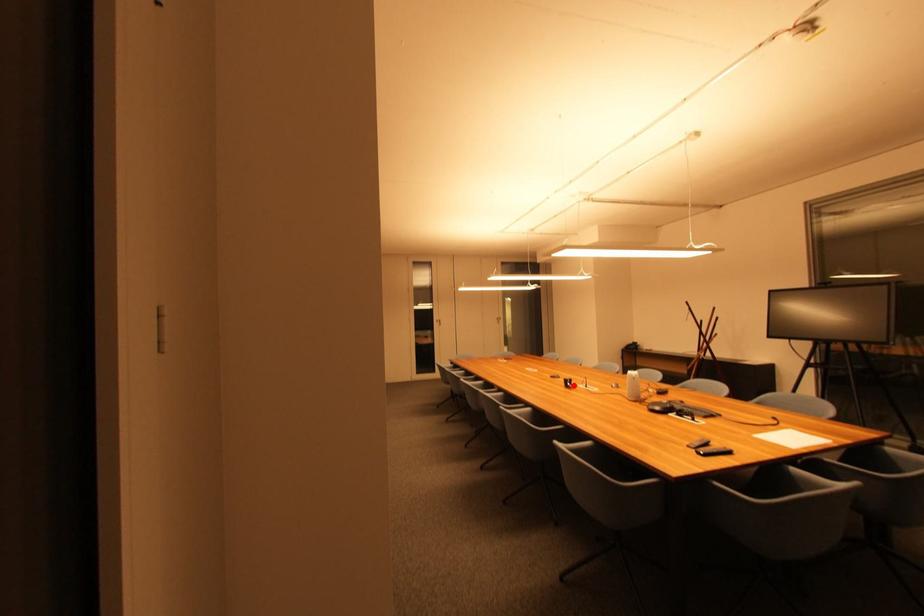
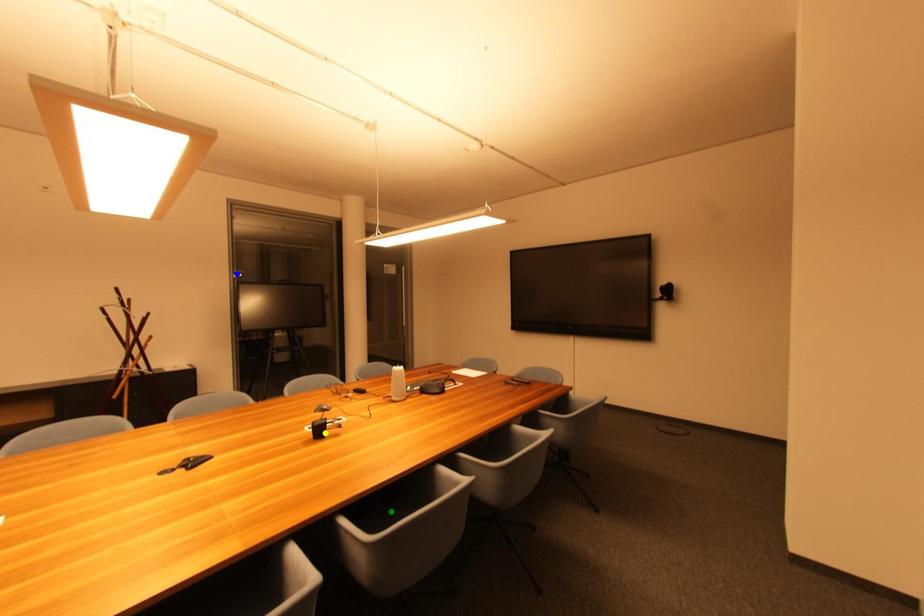
Question: I am providing you with two images of the same scene from different viewpoints. A red point is marked on the first image. You are given multiple points on the second image. Which mark in image 2 goes with the point in image 1?

Choices:
 (A) yellow point
 (B) blue point
 (C) green point

Answer: (A)